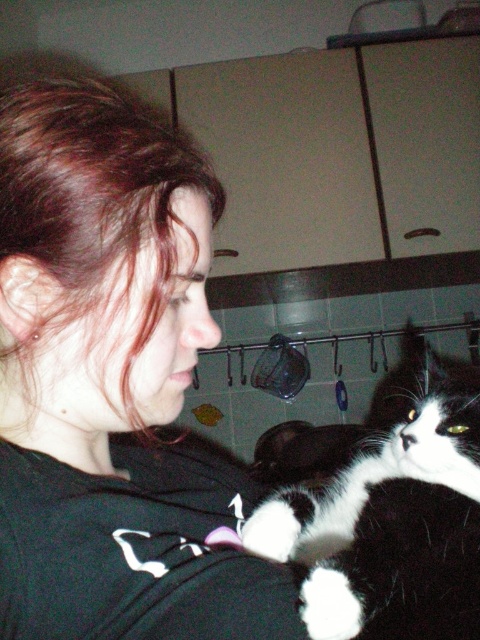
You are a photographer trying to capture a clear shot of the black and white fur at lower right and the white fur paw at shoulder. Which object is closer to the camera?

The black and white fur at lower right is closer to the camera because the white fur paw at shoulder is behind it.

Based on the photo, you are trying to take a photo of the black matte shirt at center and the white fur paw at shoulder. Which object should you focus on first to ensure both are in clear view?

You should focus on the black matte shirt at center first since it is closer to the viewer than the white fur paw at shoulder, ensuring both are in clear view.

You are a photographer trying to capture a closeup of the black and white fur at lower right and the white fur paw at shoulder in the scene. Which of the two objects has a wider width?

The black and white fur at lower right has a wider width than the white fur paw at shoulder.